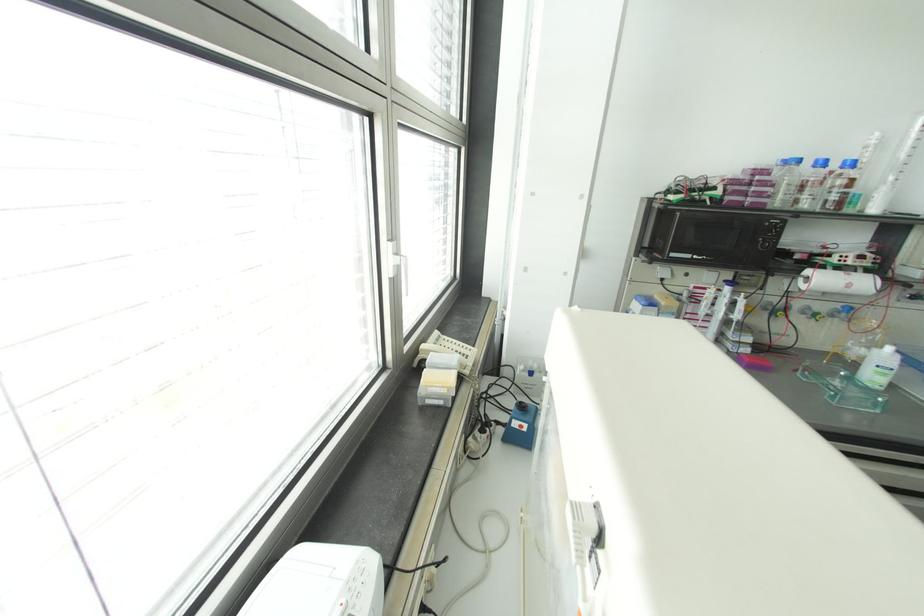
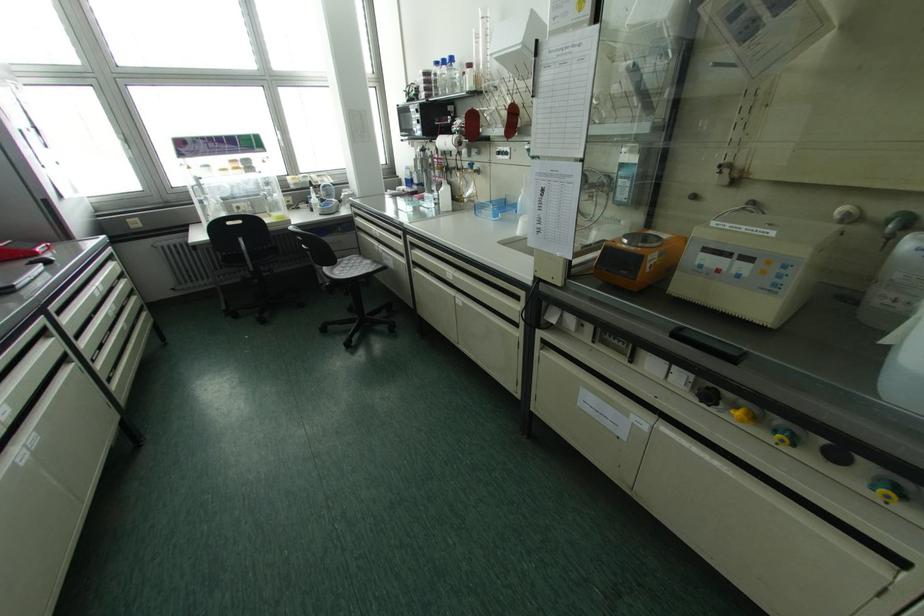
Locate, in the second image, the point that corresponds to (x=852, y=163) in the first image.

(451, 59)